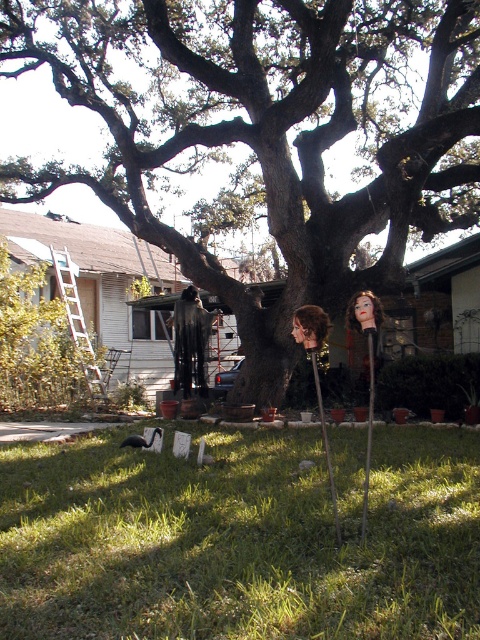
You are standing in the backyard and want to place a new garden ornament between the brown rough bark tree at center and the green grass at lower center. Based on their positions, which side of the tree should you place it on?

The brown rough bark tree at center is to the right of the green grass at lower center, so you should place the ornament to the left side of the tree to position it between them.

You are standing in the backyard and want to place a new potted plant between the green grass at lower center and the metallic silver ladder at left. Based on their positions, where should you place the potted plant?

The green grass at lower center is to the right of the metallic silver ladder at left, so you should place the potted plant between the metallic silver ladder at left and the green grass at lower center, which are positioned side by side horizontally.

You are planning to paint the brown rough bark tree at center and the metallic silver ladder at left. Since you need to choose a ladder that can reach both objects, which object requires a taller ladder based on their sizes?

The brown rough bark tree at center is larger in size than the metallic silver ladder at left, so you need a taller ladder to paint the brown rough bark tree at center.